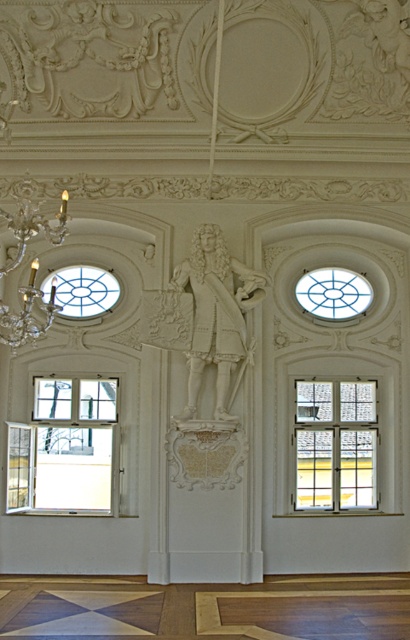
Question: Does white marble statue at center appear on the right side of clear crystal chandelier at upper left?

Choices:
 (A) no
 (B) yes

Answer: (B)

Question: Which of the following is the farthest from the observer?

Choices:
 (A) clear glass window at upper left
 (B) white marble statue at center
 (C) clear crystal chandelier at upper left

Answer: (A)

Question: Considering the relative positions of white wooden window at center and clear glass window at upper center in the image provided, where is white wooden window at center located with respect to clear glass window at upper center?

Choices:
 (A) left
 (B) right

Answer: (A)

Question: Can you confirm if clear crystal chandelier at upper left is wider than clear glass window at upper center?

Choices:
 (A) yes
 (B) no

Answer: (B)

Question: Among these points, which one is nearest to the camera?

Choices:
 (A) (9, 317)
 (B) (330, 292)

Answer: (A)

Question: Among these points, which one is farthest from the camera?

Choices:
 (A) (0, 328)
 (B) (100, 314)

Answer: (B)